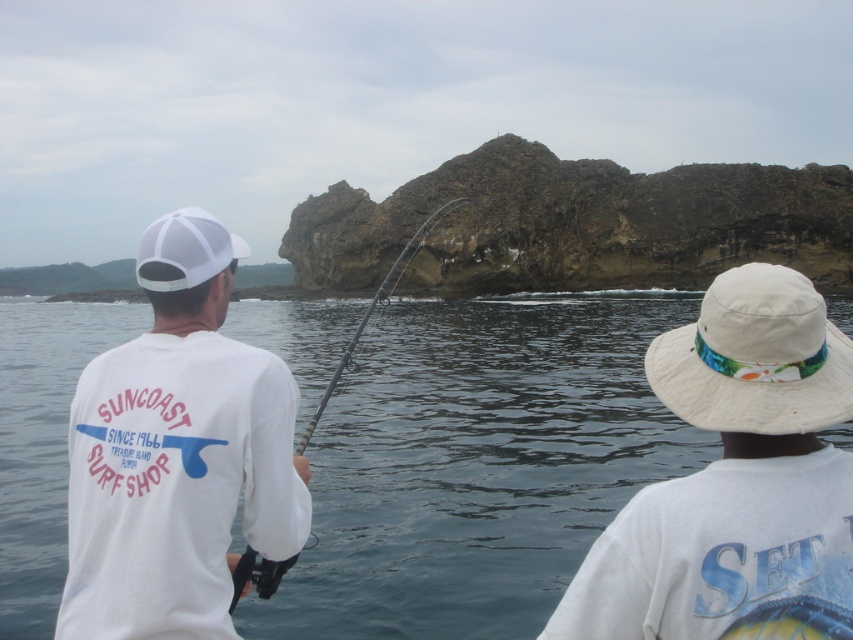
Question: Which point is closer to the camera taking this photo?

Choices:
 (A) (422, 221)
 (B) (172, 237)
 (C) (572, 259)

Answer: (B)

Question: Is white fabric hat at upper right to the left of white mesh cap at upper left from the viewer's perspective?

Choices:
 (A) no
 (B) yes

Answer: (A)

Question: Is white matte baseball cap at upper left further to camera compared to white fabric hat at right?

Choices:
 (A) yes
 (B) no

Answer: (A)

Question: Is the position of clear water at center more distant than that of white fabric hat at upper right?

Choices:
 (A) no
 (B) yes

Answer: (B)

Question: Among these objects, which one is nearest to the camera?

Choices:
 (A) white fabric hat at right
 (B) brown rocky cliff at center
 (C) black textured fishing pole at center

Answer: (A)

Question: Which object appears closest to the camera in this image?

Choices:
 (A) white mesh cap at upper left
 (B) black textured fishing pole at center

Answer: (B)